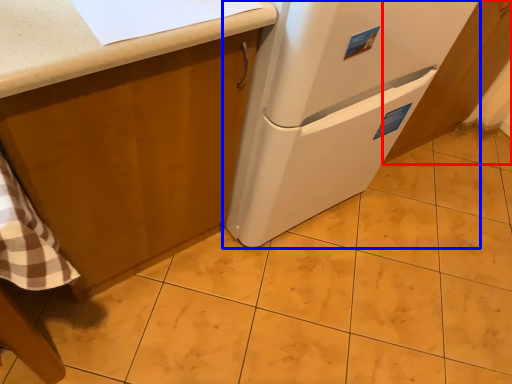
Question: Among these objects, which one is nearest to the camera, cabinetry (highlighted by a red box) or refrigerator (highlighted by a blue box)?

Choices:
 (A) cabinetry
 (B) refrigerator

Answer: (B)